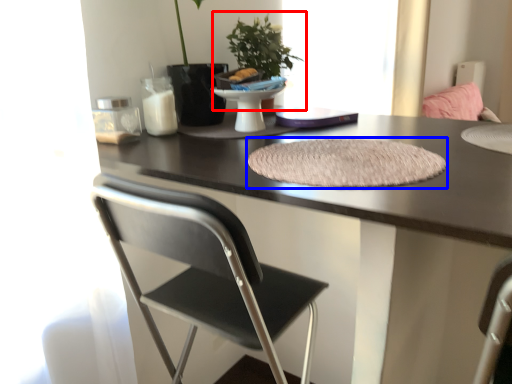
Question: Which object appears closest to the camera in this image, houseplant (highlighted by a red box) or mat (highlighted by a blue box)?

Choices:
 (A) houseplant
 (B) mat

Answer: (B)